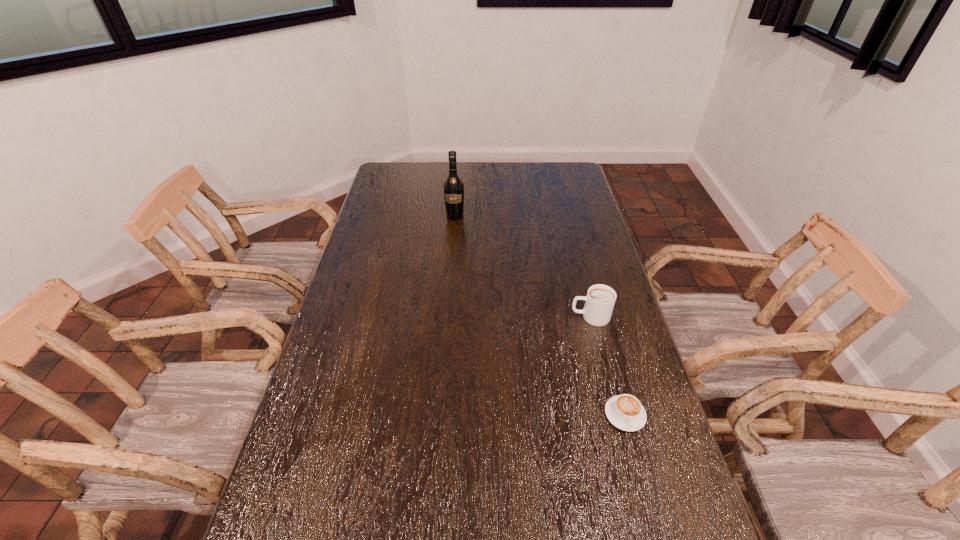
This screenshot has height=540, width=960. I want to click on the tallest object, so click(453, 186).

Locate an element on the screen. the farthest object is located at coordinates (453, 186).

Where is `the second nearest object`? This screenshot has width=960, height=540. the second nearest object is located at coordinates (599, 302).

Find the location of a particular element. This screenshot has width=960, height=540. the second shortest object is located at coordinates (599, 302).

At what (x,y) coordinates should I click in order to perform the action: click on the shortest object. Please return your answer as a coordinate pair (x, y). The image size is (960, 540). Looking at the image, I should click on (625, 411).

Image resolution: width=960 pixels, height=540 pixels. Identify the location of the nearest object. (625, 411).

You are a GUI agent. You are given a task and a screenshot of the screen. Output one action in this format:
    pyautogui.click(x=<x>, y=<y>)
    Task: Click on the vacant area situated on the label of the tallest object
    Image resolution: width=960 pixels, height=540 pixels.
    Given the screenshot: What is the action you would take?
    pyautogui.click(x=449, y=290)

Image resolution: width=960 pixels, height=540 pixels. Identify the location of free space located on the side with the handle of the second farthest object. (491, 316).

At what (x,y) coordinates should I click in order to perform the action: click on free space located 0.210m on the side with the handle of the second farthest object. Please return your answer as a coordinate pair (x, y). The image size is (960, 540). Looking at the image, I should click on pyautogui.click(x=504, y=316).

Where is `blank space located 0.300m on the side with the handle of the second farthest object`? blank space located 0.300m on the side with the handle of the second farthest object is located at coordinates (475, 316).